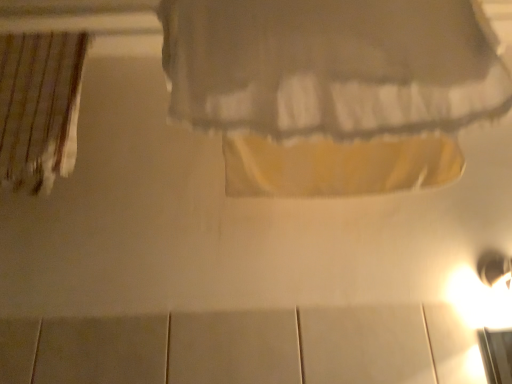
Question: Is striped fabric curtain at left, the 1th curtain from the left, in front of or behind matte white curtain at upper center, which is the 1th curtain from right to left, in the image?

Choices:
 (A) front
 (B) behind

Answer: (B)

Question: Do you think striped fabric curtain at left, the second curtain in the front-to-back sequence, is within matte white curtain at upper center, which is the 1th curtain from right to left, or outside of it?

Choices:
 (A) outside
 (B) inside

Answer: (A)

Question: Is striped fabric curtain at left, marked as the second curtain in a right-to-left arrangement, to the left or to the right of matte white curtain at upper center, acting as the 2th curtain starting from the back, in the image?

Choices:
 (A) right
 (B) left

Answer: (B)

Question: From the image's perspective, relative to striped fabric curtain at left, marked as the second curtain in a right-to-left arrangement, is matte white curtain at upper center, the second curtain positioned from the left, above or below?

Choices:
 (A) above
 (B) below

Answer: (A)

Question: Is point (384, 57) positioned closer to the camera than point (72, 62)?

Choices:
 (A) closer
 (B) farther

Answer: (A)

Question: Considering the positions of matte white curtain at upper center, which is the 1th curtain from right to left, and striped fabric curtain at left, the first curtain positioned from the back, in the image, is matte white curtain at upper center, which is the 1th curtain from right to left, bigger or smaller than striped fabric curtain at left, the first curtain positioned from the back,?

Choices:
 (A) small
 (B) big

Answer: (B)

Question: Is matte white curtain at upper center, acting as the 2th curtain starting from the back, in front of or behind striped fabric curtain at left, the first curtain positioned from the back, in the image?

Choices:
 (A) front
 (B) behind

Answer: (A)